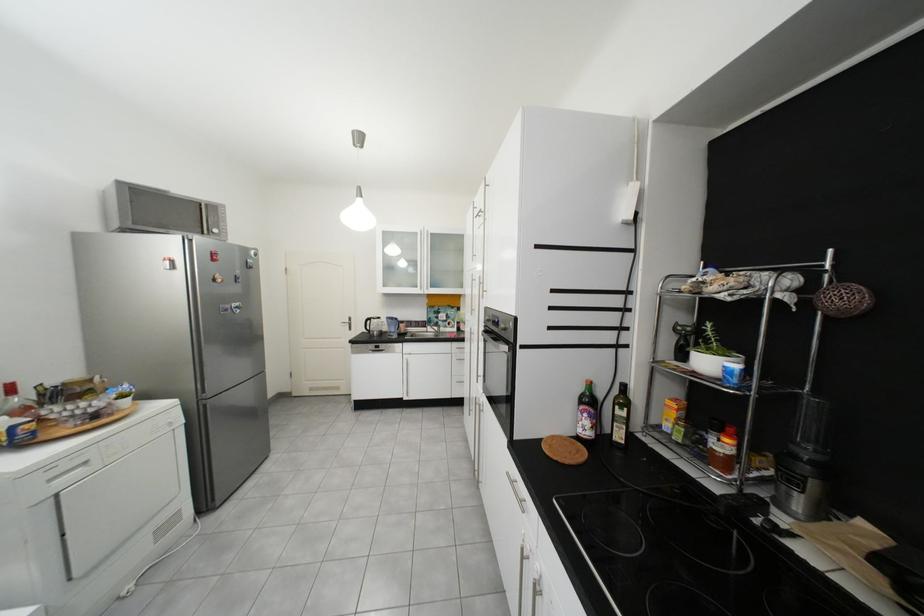
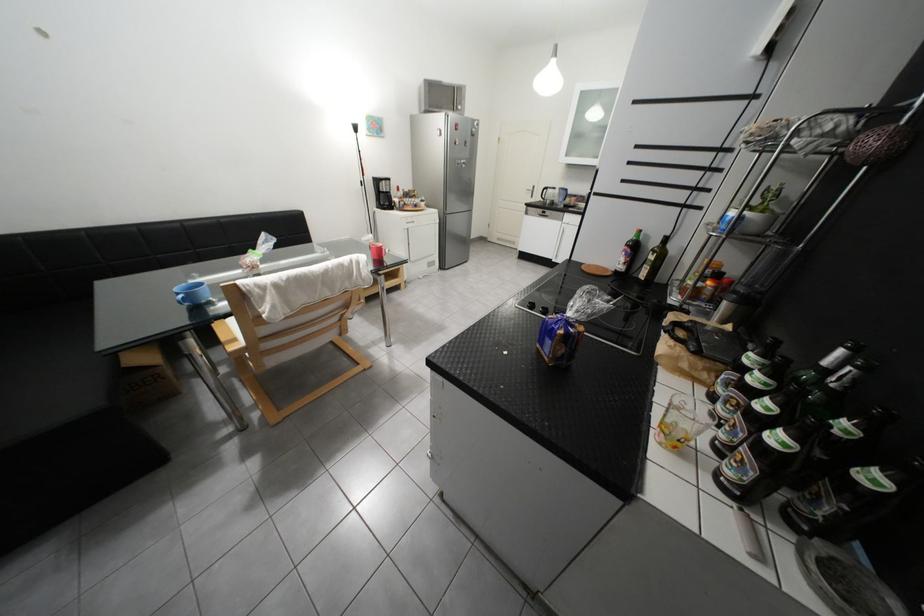
The point at (381, 321) is marked in the first image. Where is the corresponding point in the second image?

(557, 190)